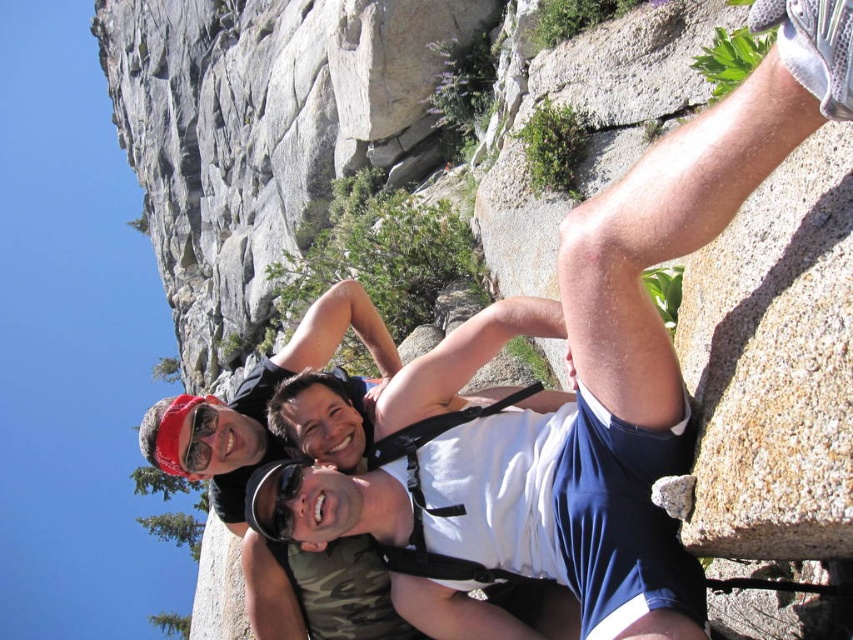
Does white fabric shirt at center have a lesser height compared to black plastic goggles at center?

No, white fabric shirt at center is not shorter than black plastic goggles at center.

The width and height of the screenshot is (853, 640). Describe the element at coordinates (691, 209) in the screenshot. I see `white fabric shirt at center` at that location.

This screenshot has height=640, width=853. What do you see at coordinates (691, 209) in the screenshot?
I see `white fabric shirt at center` at bounding box center [691, 209].

Image resolution: width=853 pixels, height=640 pixels. I want to click on white fabric shirt at center, so click(691, 209).